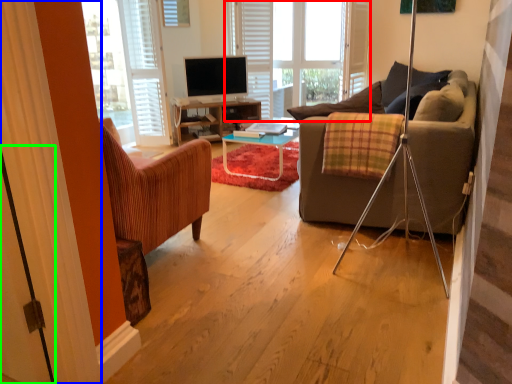
Question: Which object is the closest to the bay window (highlighted by a red box)? Choose among these: curtain (highlighted by a blue box) or screen door (highlighted by a green box).

Choices:
 (A) curtain
 (B) screen door

Answer: (A)